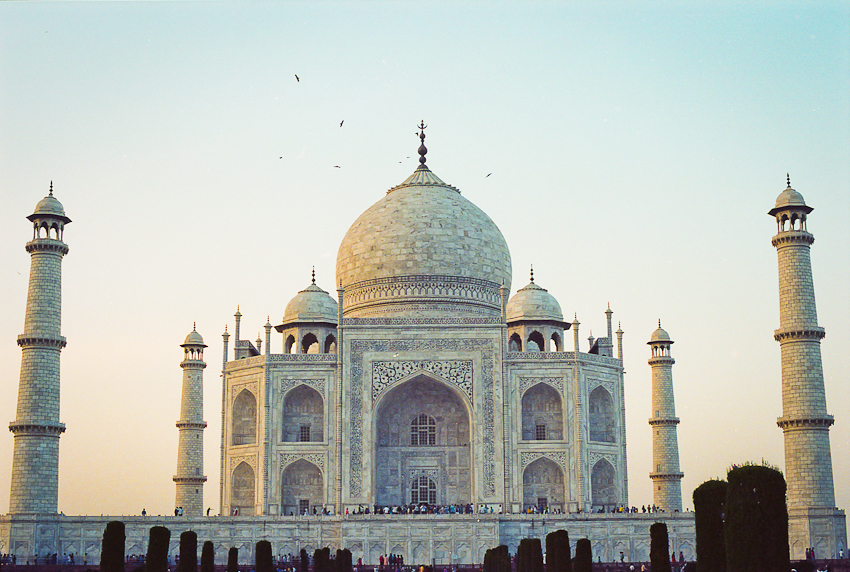
The width and height of the screenshot is (850, 572). Identify the location of concrete wall. tap(31, 532), tap(224, 530), tap(417, 528), tap(639, 524), tap(683, 534).